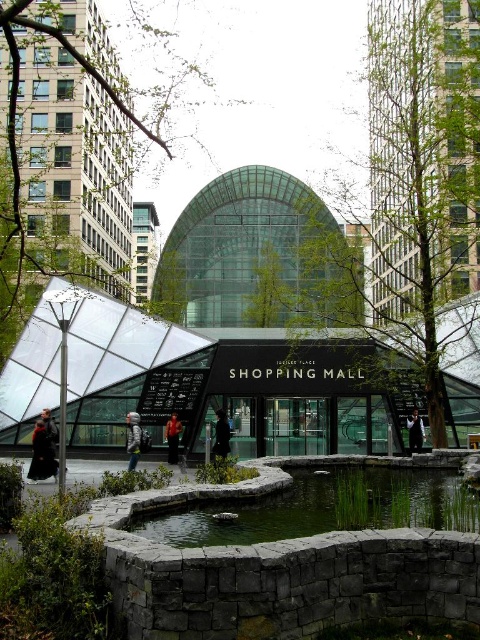
You are standing in front of the shopping mall and notice two coats on a bench. The black leather coat at lower left and the gray wool coat at center. Which coat is positioned higher up?

The black leather coat at lower left is located above the gray wool coat at center, so it is positioned higher up.

Looking at this image, you are trying to decide which coat to wear for a cold day. You see both the gray wool coat at center and the denim jacket at center in the image. Which one would be more suitable for keeping you warm based on their sizes?

The gray wool coat at center is larger in size compared to the denim jacket at center, making it more suitable for keeping you warm as larger coats generally provide better insulation.

You are standing in front of the shopping mall and notice two items on the ground near the pond. You see a gray wool coat at center and a denim jacket at center. Which item is closer to the water in the pond?

The gray wool coat at center is located below denim jacket at center, so the gray wool coat at center is closer to the water in the pond.